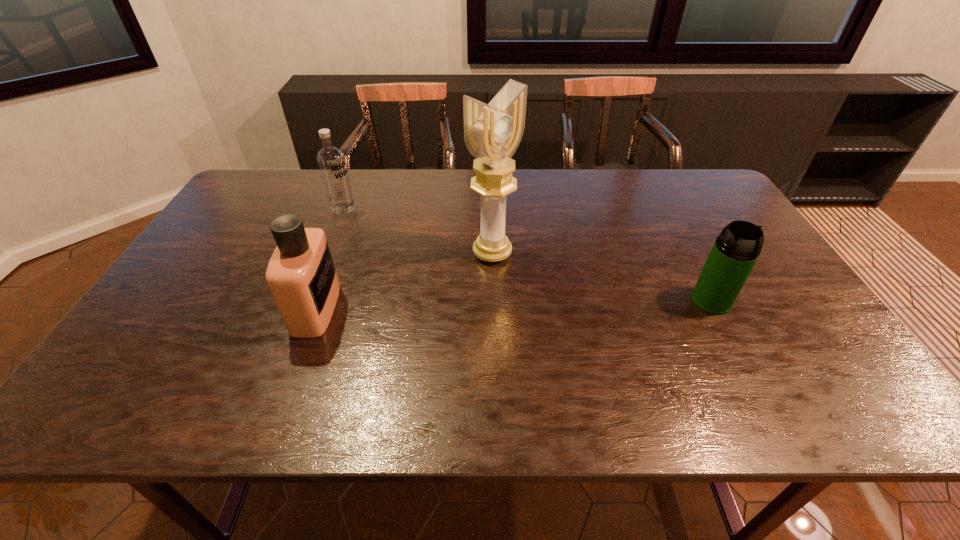
In order to click on vacant space situated 0.130m on the front label of the farthest object in this screenshot , I will do `click(377, 230)`.

At what (x,y) coordinates should I click in order to perform the action: click on free space located on the front label of the farthest object. Please return your answer as a coordinate pair (x, y). This screenshot has width=960, height=540. Looking at the image, I should click on (396, 242).

Find the location of a particular element. This screenshot has width=960, height=540. vacant space located on the front label of the farthest object is located at coordinates (437, 267).

The image size is (960, 540). Identify the location of object at the far edge. (x=331, y=161).

The height and width of the screenshot is (540, 960). In order to click on vacant space at the far edge of the desktop in this screenshot , I will do `click(362, 205)`.

This screenshot has width=960, height=540. In the image, there is a desktop. In order to click on vacant area at the near edge in this screenshot , I will do `click(736, 362)`.

This screenshot has width=960, height=540. In the image, there is a desktop. In order to click on vacant space at the left edge in this screenshot , I will do `click(226, 238)`.

The height and width of the screenshot is (540, 960). I want to click on free space at the right edge, so [765, 334].

You are a GUI agent. You are given a task and a screenshot of the screen. Output one action in this format:
    pyautogui.click(x=<x>, y=<y>)
    Task: Click on the free region at the far left corner of the desktop
    
    Given the screenshot: What is the action you would take?
    pyautogui.click(x=270, y=187)

At what (x,y) coordinates should I click in order to perform the action: click on vacant area at the far right corner. Please return your answer as a coordinate pair (x, y). Image resolution: width=960 pixels, height=540 pixels. Looking at the image, I should click on 710,195.